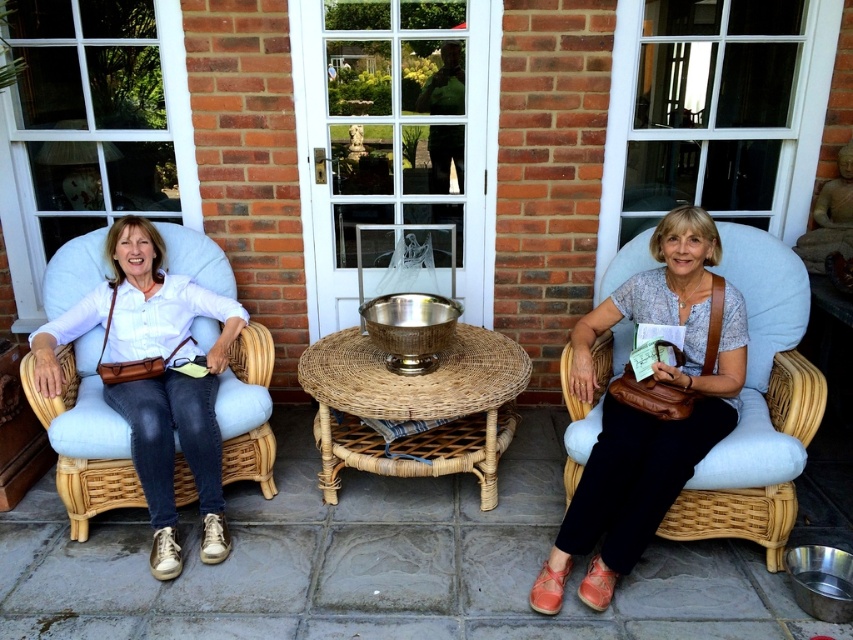
Does matte leather armchair at right appear under woven rattan table at center?

No, matte leather armchair at right is not below woven rattan table at center.

Which is behind, point (730, 481) or point (326, 396)?

The point (326, 396) is more distant.

The width and height of the screenshot is (853, 640). I want to click on matte leather armchair at right, so click(758, 406).

Can you confirm if matte white blouse at left is positioned to the left of woven rattan table at center?

Correct, you'll find matte white blouse at left to the left of woven rattan table at center.

What do you see at coordinates (155, 378) in the screenshot? This screenshot has height=640, width=853. I see `matte white blouse at left` at bounding box center [155, 378].

Who is more forward, (49, 394) or (349, 442)?

Point (49, 394)

This screenshot has height=640, width=853. Find the location of `matte white blouse at left`. matte white blouse at left is located at coordinates (155, 378).

Between matte leather armchair at right and matte white blouse at left, which one is positioned higher?

matte leather armchair at right

Where is `matte leather armchair at right`? The image size is (853, 640). matte leather armchair at right is located at coordinates 758,406.

Is point (770, 432) farther from camera compared to point (219, 456)?

That is False.

You are a GUI agent. You are given a task and a screenshot of the screen. Output one action in this format:
    pyautogui.click(x=<x>, y=<y>)
    Task: Click on the matte leather armchair at right
    
    Given the screenshot: What is the action you would take?
    pyautogui.click(x=758, y=406)